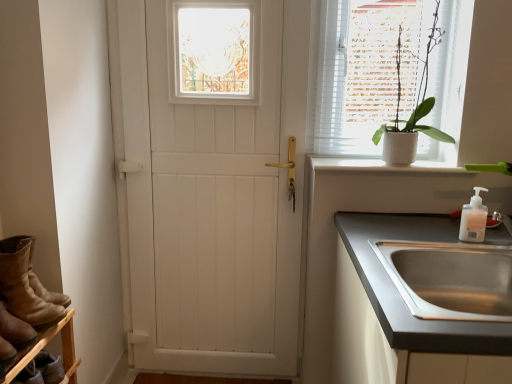
Question: Considering the relative positions of brown suede boots at lower left and brown suede boot at lower left in the image provided, is brown suede boots at lower left to the left of brown suede boot at lower left from the viewer's perspective?

Choices:
 (A) no
 (B) yes

Answer: (A)

Question: Is brown suede boots at lower left outside of brown suede boot at lower left?

Choices:
 (A) no
 (B) yes

Answer: (B)

Question: Does brown suede boots at lower left come in front of brown suede boot at lower left?

Choices:
 (A) no
 (B) yes

Answer: (A)

Question: From a real-world perspective, is brown suede boots at lower left on top of brown suede boot at lower left?

Choices:
 (A) yes
 (B) no

Answer: (A)

Question: Is brown suede boots at lower left not close to brown suede boot at lower left?

Choices:
 (A) yes
 (B) no

Answer: (B)

Question: From a real-world perspective, relative to brown suede boot at lower left, is white matte door at center vertically above or below?

Choices:
 (A) above
 (B) below

Answer: (A)

Question: From the image's perspective, is white matte door at center above or below brown suede boot at lower left?

Choices:
 (A) above
 (B) below

Answer: (A)

Question: Does point (231, 233) appear closer or farther from the camera than point (16, 344)?

Choices:
 (A) closer
 (B) farther

Answer: (B)

Question: Do you think white matte door at center is within brown suede boot at lower left, or outside of it?

Choices:
 (A) inside
 (B) outside

Answer: (B)

Question: In terms of size, does white plastic soap dispenser at upper right appear bigger or smaller than brown suede boots at lower left?

Choices:
 (A) small
 (B) big

Answer: (A)

Question: From the image's perspective, is white plastic soap dispenser at upper right located above or below brown suede boots at lower left?

Choices:
 (A) below
 (B) above

Answer: (B)

Question: In the image, is white plastic soap dispenser at upper right on the left side or the right side of brown suede boots at lower left?

Choices:
 (A) right
 (B) left

Answer: (A)

Question: Considering the positions of white plastic soap dispenser at upper right and brown suede boots at lower left in the image, is white plastic soap dispenser at upper right wider or thinner than brown suede boots at lower left?

Choices:
 (A) wide
 (B) thin

Answer: (B)

Question: Is white smooth window sill at upper right situated inside white matte door at center or outside?

Choices:
 (A) outside
 (B) inside

Answer: (A)

Question: Is point (437, 163) positioned closer to the camera than point (283, 185)?

Choices:
 (A) closer
 (B) farther

Answer: (A)